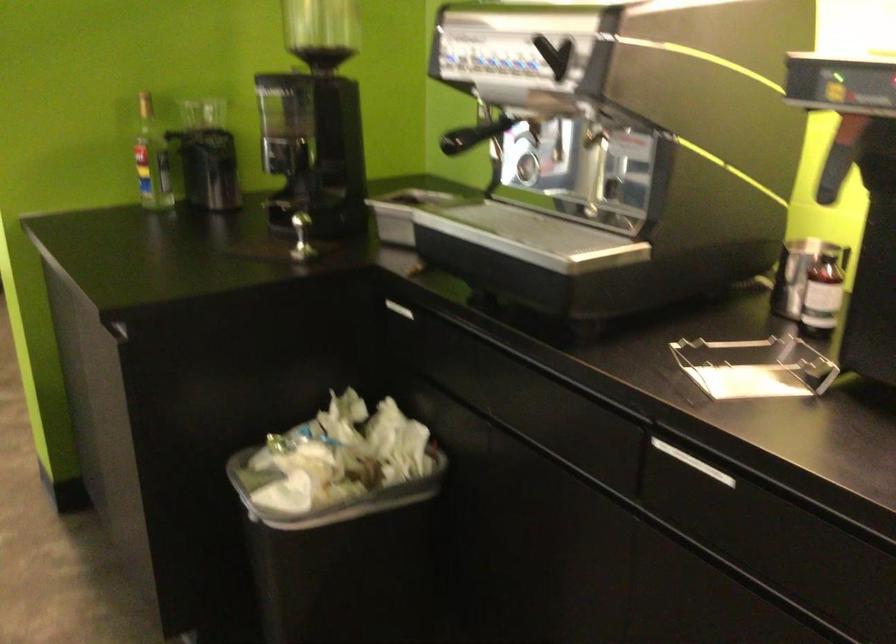
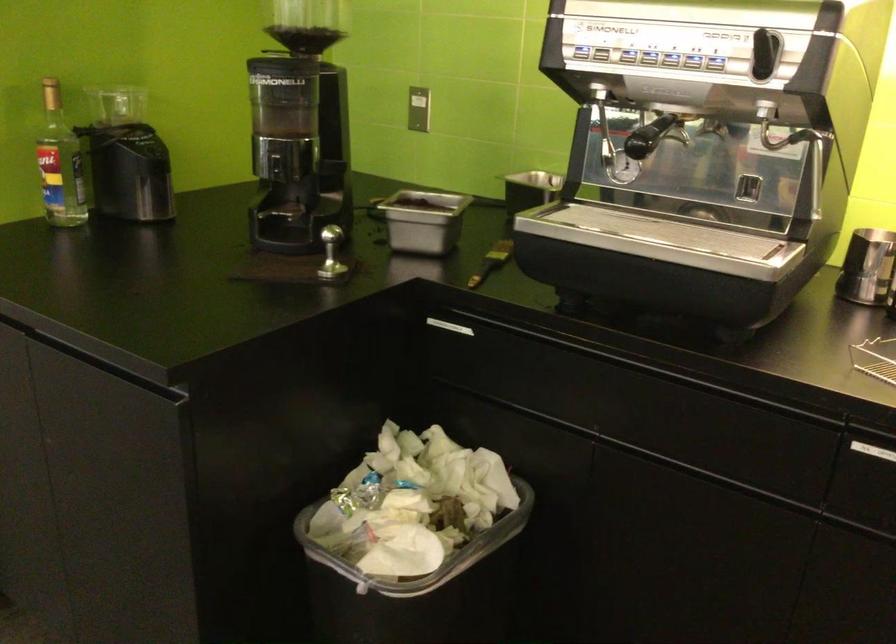
Question: The camera is either moving clockwise (left) or counter-clockwise (right) around the object. The first image is from the beginning of the video and the second image is from the end. Is the camera moving left or right when shooting the video?

Choices:
 (A) Left
 (B) Right

Answer: (A)